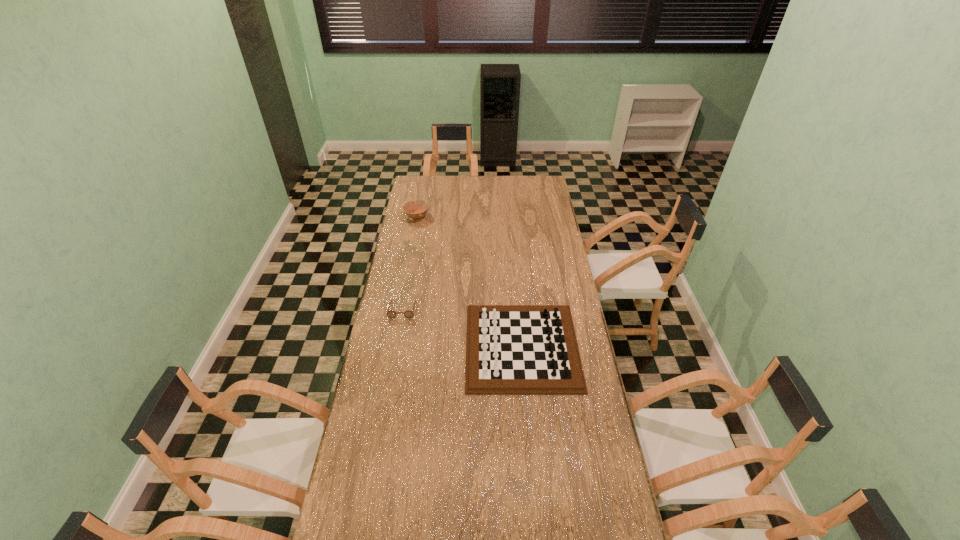
Identify the location of object present at the right edge. (510, 349).

This screenshot has width=960, height=540. In order to click on vacant space at the far edge of the desktop in this screenshot , I will do click(x=497, y=178).

Find the location of a particular element. The image size is (960, 540). vacant space at the left edge of the desktop is located at coordinates (424, 267).

Find the location of a particular element. Image resolution: width=960 pixels, height=540 pixels. vacant area at the right edge of the desktop is located at coordinates (552, 200).

Where is `empty space that is in between the shortest object and the second tallest object`? empty space that is in between the shortest object and the second tallest object is located at coordinates 410,263.

Image resolution: width=960 pixels, height=540 pixels. I want to click on vacant space in between the farthest object and the shortest object, so click(x=410, y=263).

Identify the location of vacant area that lies between the rightmost object and the shortest object. This screenshot has height=540, width=960. (462, 328).

Where is `vacant area between the gameboard and the second tallest object`? The height and width of the screenshot is (540, 960). vacant area between the gameboard and the second tallest object is located at coordinates (469, 281).

Point out which object is positioned as the nearest to the rightmost object. Please provide its 2D coordinates. Your answer should be formatted as a tuple, i.e. [(x, y)], where the tuple contains the x and y coordinates of a point satisfying the conditions above.

[(391, 314)]

At what (x,y) coordinates should I click in order to perform the action: click on the second closest object to the shortest object. Please return your answer as a coordinate pair (x, y). The height and width of the screenshot is (540, 960). Looking at the image, I should click on (421, 206).